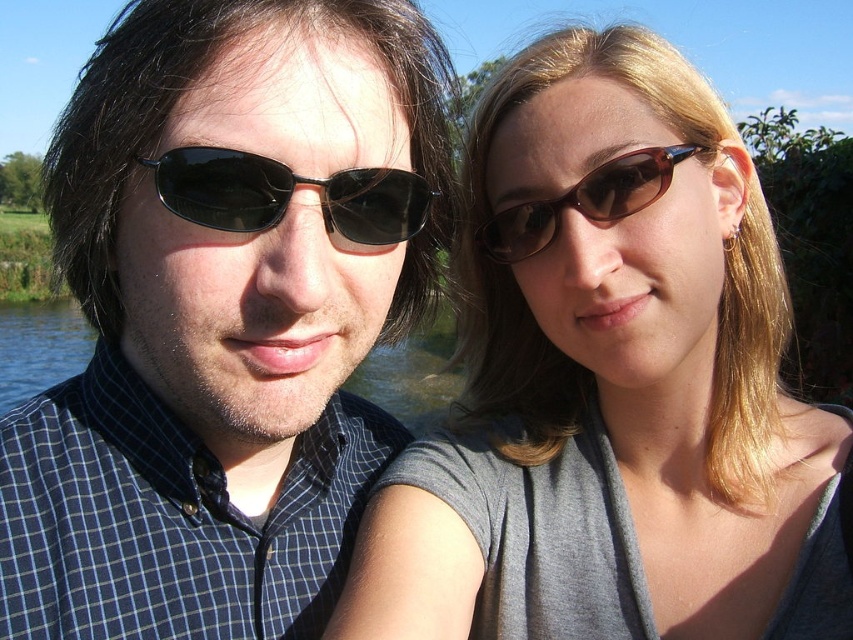
Measure the distance between matte gray shirt at center and brown matte sunglasses at upper center.

They are 10.46 inches apart.

From the picture: Who is higher up, matte gray shirt at center or brown matte sunglasses at upper center?

Positioned higher is brown matte sunglasses at upper center.

Between point (381, 538) and point (614, 184), which one is positioned in front?

Point (381, 538) is more forward.

Locate an element on the screen. matte gray shirt at center is located at coordinates (611, 385).

Can you confirm if matte gray shirt at center is positioned below black matte sunglasses at left?

Indeed, matte gray shirt at center is positioned under black matte sunglasses at left.

Is matte gray shirt at center smaller than black matte sunglasses at left?

No, matte gray shirt at center is not smaller than black matte sunglasses at left.

This screenshot has width=853, height=640. Find the location of `matte gray shirt at center`. matte gray shirt at center is located at coordinates (611, 385).

Is point (273, 180) positioned after point (511, 220)?

That is False.

Who is positioned more to the left, black matte sunglasses at left or brown matte sunglasses at upper center?

black matte sunglasses at left is more to the left.

You are a GUI agent. You are given a task and a screenshot of the screen. Output one action in this format:
    pyautogui.click(x=<x>, y=<y>)
    Task: Click on the black matte sunglasses at left
    Image resolution: width=853 pixels, height=640 pixels.
    Given the screenshot: What is the action you would take?
    pyautogui.click(x=288, y=195)